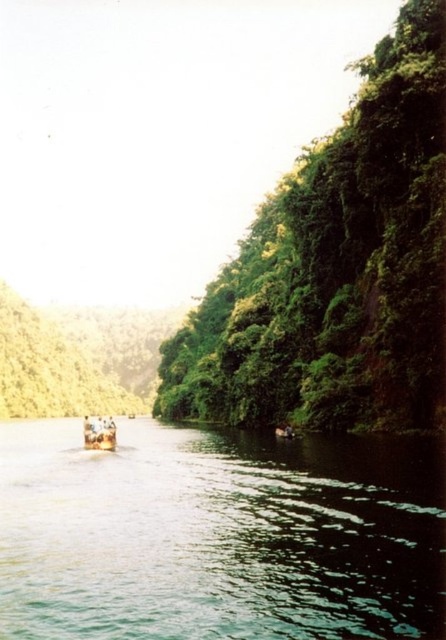
You are standing at the point marked as point (218, 536) in the image. What object are you standing on?

You are standing on the green glossy water at center located at point (218, 536).

You are standing on a bridge overlooking the green glossy water at center and the green leafy tree at center. Which object is closer to the water surface?

The green glossy water at center is below the green leafy tree at center, so the water is closer to the surface than the tree.

You are standing on the riverbank and want to compare the widths of the green leafy trees at right and the green leafy tree at center. Which one is wider?

The green leafy tree at center is wider than the green leafy trees at right.